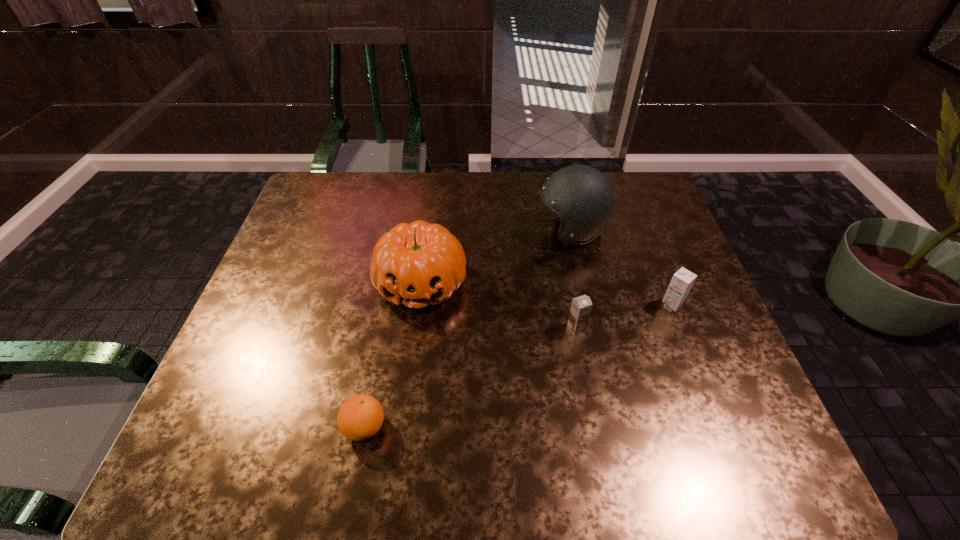
I want to click on vacant region located 0.270m at the face opening of the tallest object, so click(x=444, y=230).

Identify the location of vacant region located 0.320m on the carved face of the pumpkin. tap(400, 449).

Identify the location of free space located on the back of the right chocolate milk. click(641, 230).

You are a GUI agent. You are given a task and a screenshot of the screen. Output one action in this format:
    pyautogui.click(x=<x>, y=<y>)
    Task: Click on the vacant region located 0.110m on the front of the fourth farthest object
    Image resolution: width=960 pixels, height=540 pixels.
    Given the screenshot: What is the action you would take?
    pyautogui.click(x=586, y=376)

The width and height of the screenshot is (960, 540). I want to click on vacant area located on the right of the nearest object, so click(x=487, y=427).

I want to click on object that is at the far edge, so click(582, 196).

Where is `object present at the near edge`? The image size is (960, 540). object present at the near edge is located at coordinates (360, 417).

I want to click on object that is at the right edge, so click(x=682, y=281).

In the image, there is a desktop. Identify the location of free space at the far edge. (477, 180).

This screenshot has height=540, width=960. Find the location of `vacant space at the near edge`. vacant space at the near edge is located at coordinates (634, 474).